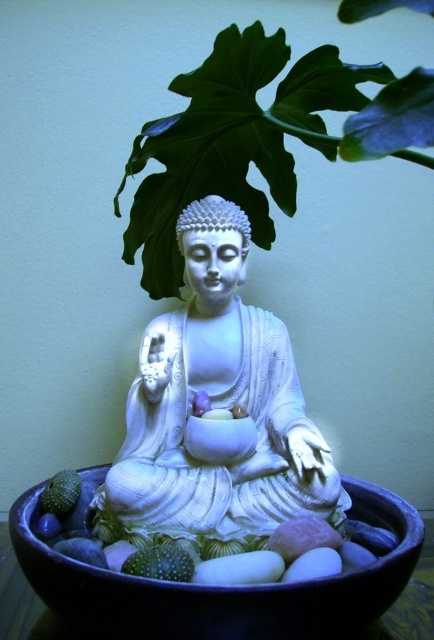
You are standing in front of the white ceramic statue of Buddha. There is a point at coordinates (260, 138). What object is located at that point?

The point at coordinates (260, 138) corresponds to the green leafy plant at upper center.

You are standing in front of a serene scene with a white ceramic statue of Buddha. There is a point at coordinates (219, 408). What object is located at this point?

The point at coordinates (219, 408) marks the white glossy statue at center.